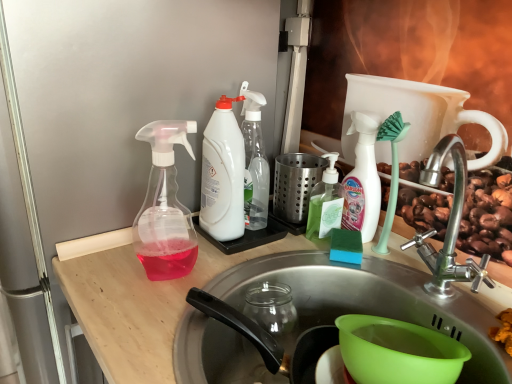
This screenshot has height=384, width=512. In order to click on free space to the right of transparent plastic spray bottle at left, the first bottle when ordered from left to right in this screenshot , I will do `click(248, 260)`.